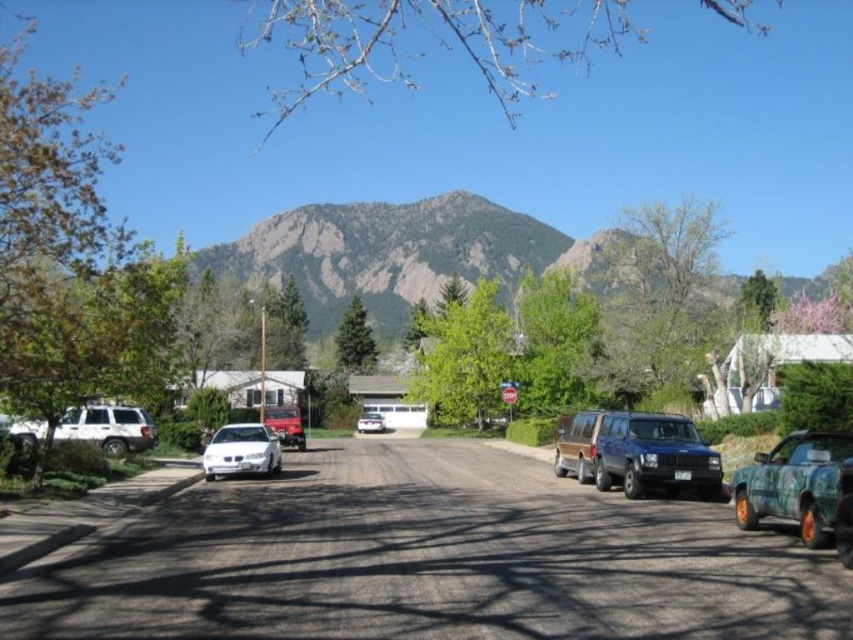
Question: Which of the following is the farthest from the observer?

Choices:
 (A) (146, 412)
 (B) (827, 480)
 (C) (209, 461)

Answer: (A)

Question: Estimate the real-world distances between objects in this image. Which object is closer to the camouflage paint truck at lower right?

Choices:
 (A) white glossy sedan at center
 (B) matte blue suv at center
 (C) white matte suv at left
 (D) white matte sedan at center

Answer: (B)

Question: Observing the image, what is the correct spatial positioning of white glossy sedan at center in reference to white matte sedan at center?

Choices:
 (A) above
 (B) below

Answer: (A)

Question: Is white matte suv at left smaller than white matte sedan at center?

Choices:
 (A) no
 (B) yes

Answer: (A)

Question: Which of the following is the farthest from the observer?

Choices:
 (A) camouflage paint truck at lower right
 (B) white matte suv at left
 (C) white matte sedan at center

Answer: (C)

Question: Does white matte suv at left have a larger size compared to white glossy sedan at center?

Choices:
 (A) yes
 (B) no

Answer: (A)